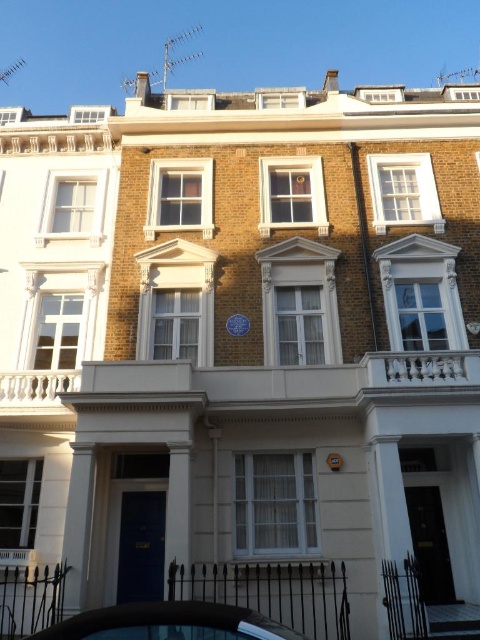
You are standing in front of the townhouses and see the shiny black car at lower center and the yellow plastic clock at center. Which object is nearer to you?

The shiny black car at lower center is closer to the viewer than the yellow plastic clock at center.

You are a delivery person who needs to park your 2.5 meters wide delivery van between the shiny black car at lower center and the yellow plastic clock at center. Which side should you park on to ensure there is enough space for your van?

The shiny black car at lower center is wider than the yellow plastic clock at center. Therefore, you should park your van on the side of the yellow plastic clock at center since it requires less space compared to the shiny black car at lower center.